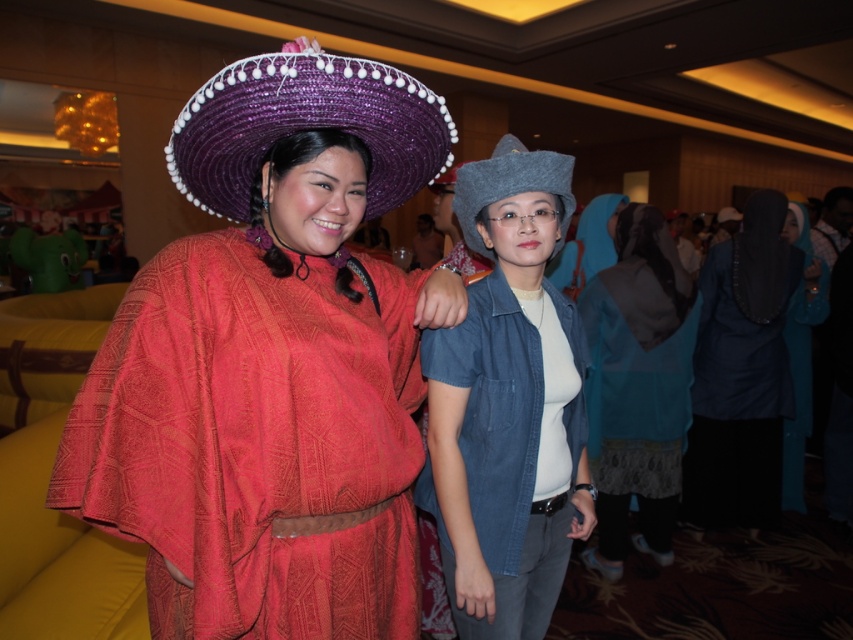
You are at a fashion show and see two dresses displayed on mannequins at the center of the stage. The matte red fabric dress at center and the blue textured dress at center. Which dress is positioned higher on the stage?

The matte red fabric dress at center is located above the blue textured dress at center, so it is positioned higher on the stage.

You are at a social event and want to find the blue textured dress at center. The point given is at coordinates (x=637, y=387). Is this point located on the blue textured dress at center?

Yes, the point at coordinates (x=637, y=387) is located on the blue textured dress at center as stated in the description.

You are at a social event and want to locate the matte red fabric dress at center. According to the coordinates provided, where should you look?

The matte red fabric dress at center is located at point coordinates of (271,364).